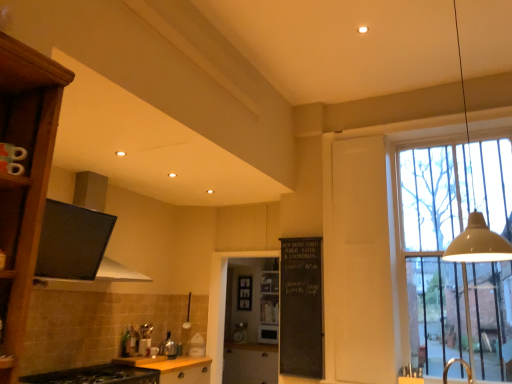
Question: Is matte wood cabinet at center, which is the third cabinetry from front to back, in front of or behind wooden at center in the image?

Choices:
 (A) front
 (B) behind

Answer: (A)

Question: Would you say matte wood cabinet at center, acting as the first cabinetry starting from the bottom, is to the left or to the right of wooden at center in the picture?

Choices:
 (A) left
 (B) right

Answer: (A)

Question: Which object is the closest to the black chalkboard at center?

Choices:
 (A) black matte exhaust hood at upper left
 (B) matte wood cabinet at center, acting as the first cabinetry starting from the bottom
 (C) white glossy toaster at center, which is the 2th appliance from back to front
 (D) beige matte pendant lamp at upper right
 (E) matte black microwave at center, the second appliance from the left

Answer: (C)

Question: Based on their relative distances, which object is farther from the matte wood cabinet at center, marked as the 1th cabinetry in a back-to-front arrangement?

Choices:
 (A) wooden at center
 (B) clear glass window at right
 (C) transparent glass screen door at center
 (D) white glossy toaster at center, marked as the 2th appliance in a bottom-to-top arrangement
 (E) matte black microwave at center, the 2th appliance positioned from the top

Answer: (B)